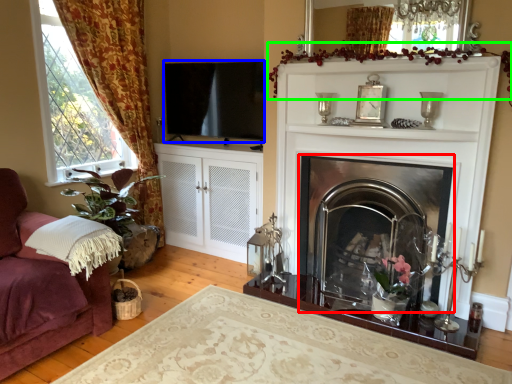
Question: Estimate the real-world distances between objects in this image. Which object is farther from fireplace (highlighted by a red box), window screen (highlighted by a blue box) or plant (highlighted by a green box)?

Choices:
 (A) window screen
 (B) plant

Answer: (A)